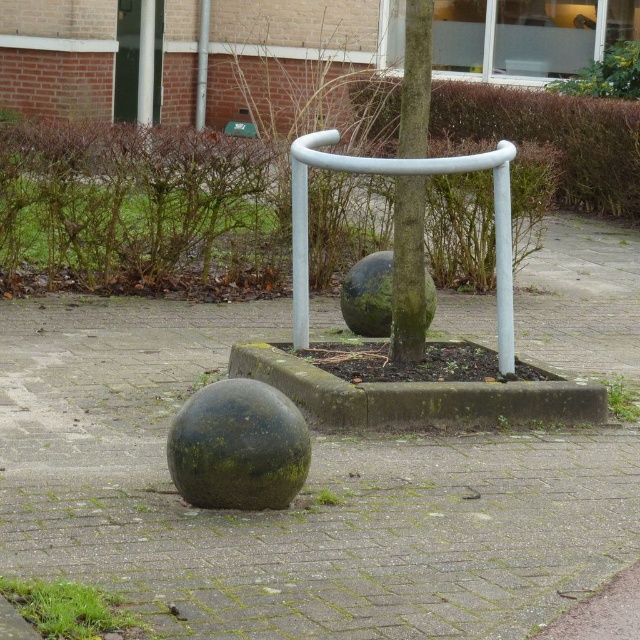
The image size is (640, 640). I want to click on green mossy concrete at center, so click(x=417, y=396).

From the picture: Is green mossy concrete at center to the right of green mossy tree at center from the viewer's perspective?

No, green mossy concrete at center is not to the right of green mossy tree at center.

Is point (333, 408) positioned behind point (413, 67)?

No, it is not.

What are the coordinates of `green mossy concrete at center` in the screenshot? It's located at (417, 396).

Is white matte rail at center taller than green mossy tree at center?

No.

Can you confirm if white matte rail at center is positioned to the right of green mossy tree at center?

In fact, white matte rail at center is to the left of green mossy tree at center.

The height and width of the screenshot is (640, 640). What do you see at coordinates (401, 177) in the screenshot?
I see `white matte rail at center` at bounding box center [401, 177].

Where is `white matte rail at center`? This screenshot has height=640, width=640. white matte rail at center is located at coordinates (401, 177).

Who is taller, green mossy sphere at lower left or green mossy tree at center?

Standing taller between the two is green mossy tree at center.

Describe the element at coordinates (296, 502) in the screenshot. I see `green mossy sphere at lower left` at that location.

The height and width of the screenshot is (640, 640). I want to click on green mossy sphere at lower left, so click(x=296, y=502).